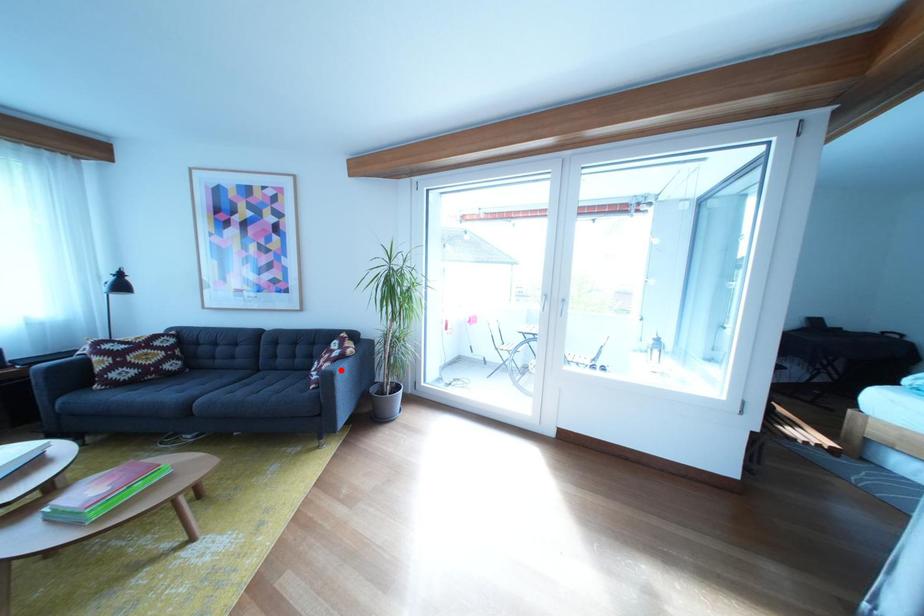
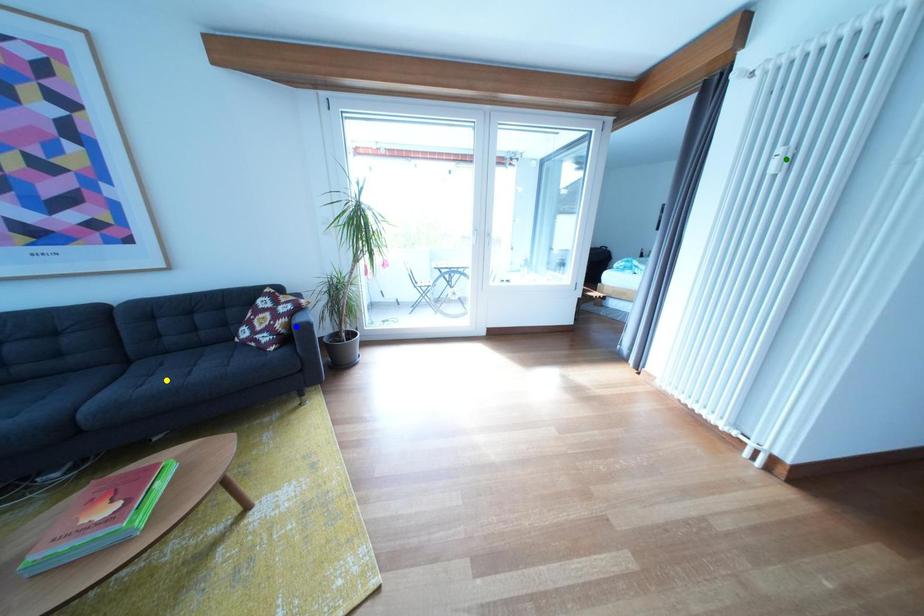
Question: I am providing you with two images of the same scene from different viewpoints. A red point is marked on the first image. You are given multiple points on the second image. In image 2, which mark is for the same physical point as the one in image 1?

Choices:
 (A) green point
 (B) yellow point
 (C) blue point

Answer: (C)